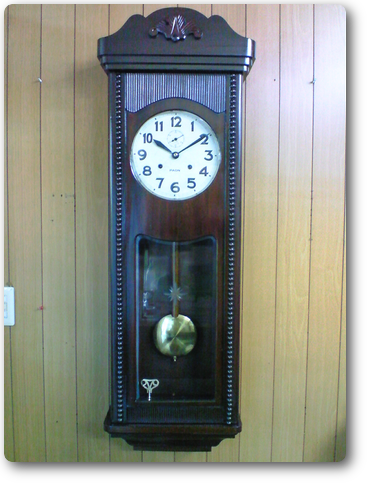
Identify the location of wood case. [x=215, y=208].